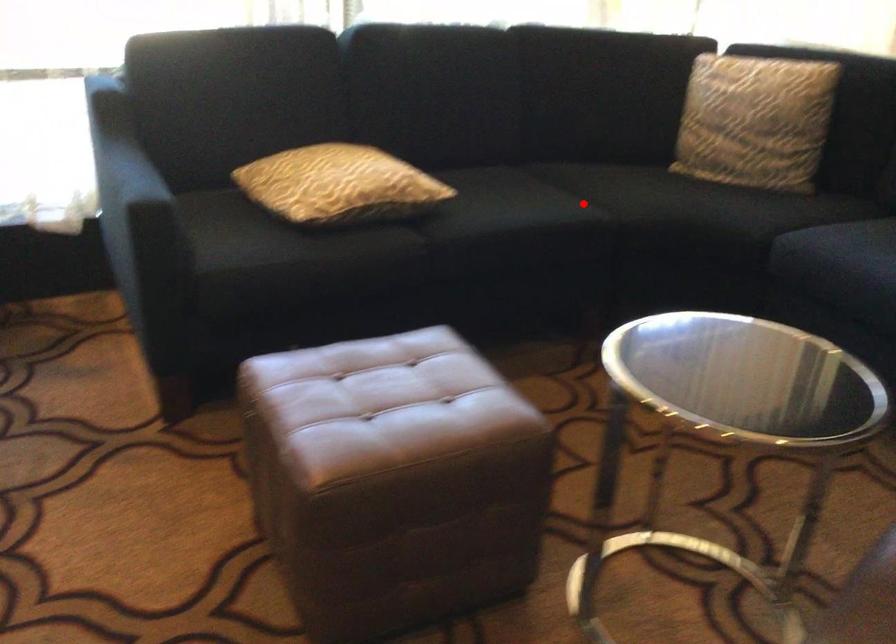
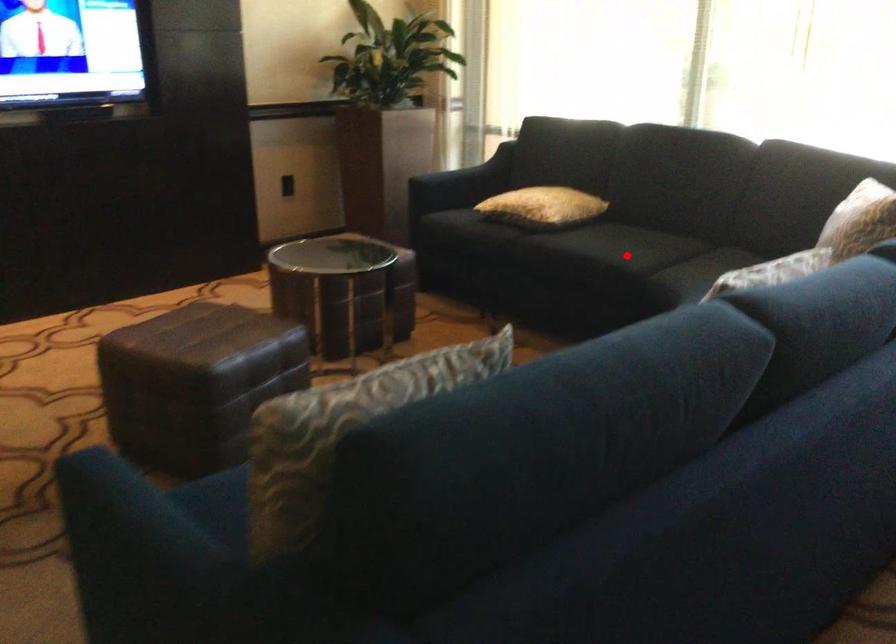
I am providing you with two images of the same scene from different viewpoints. A red point is marked on the first image and another point is marked on the second image. Does the point marked in image1 correspond to the same location as the one in image2?

Yes